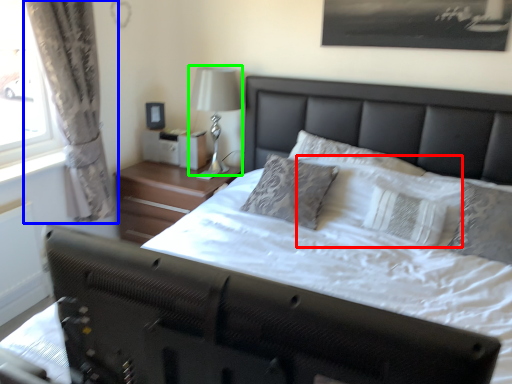
Question: Which object is the farthest from pillow (highlighted by a red box)? Choose among these: curtain (highlighted by a blue box) or bedside lamp (highlighted by a green box).

Choices:
 (A) curtain
 (B) bedside lamp

Answer: (A)